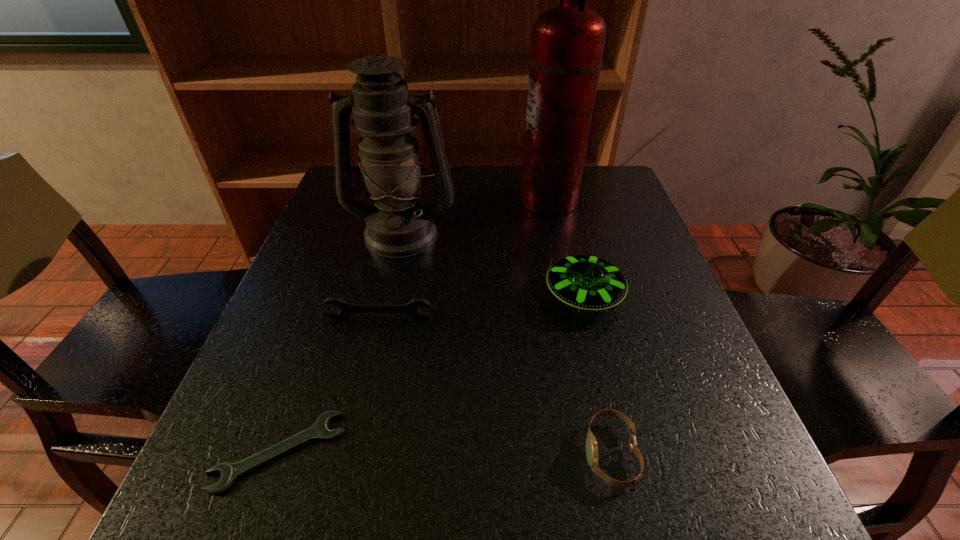
The width and height of the screenshot is (960, 540). In order to click on wrench situated at the near edge in this screenshot , I will do `click(229, 472)`.

Image resolution: width=960 pixels, height=540 pixels. I want to click on oil lamp at the left edge, so click(399, 225).

You are a GUI agent. You are given a task and a screenshot of the screen. Output one action in this format:
    pyautogui.click(x=<x>, y=<y>)
    Task: Click on the fire extinguisher that is positioned at the right edge
    The width and height of the screenshot is (960, 540).
    Given the screenshot: What is the action you would take?
    pyautogui.click(x=567, y=44)

The image size is (960, 540). In order to click on saucer that is positioned at the right edge in this screenshot , I will do coord(585,282).

At what (x,y) coordinates should I click in order to perform the action: click on object present at the far left corner. Please return your answer as a coordinate pair (x, y). This screenshot has width=960, height=540. Looking at the image, I should click on (399, 225).

Where is `object at the near left corner`? object at the near left corner is located at coordinates (229, 472).

Where is `object located in the far right corner section of the desktop`? This screenshot has width=960, height=540. object located in the far right corner section of the desktop is located at coordinates (567, 44).

The height and width of the screenshot is (540, 960). I want to click on vacant space at the far edge of the desktop, so click(x=492, y=189).

Where is `vacant area at the left edge`? This screenshot has height=540, width=960. vacant area at the left edge is located at coordinates (255, 378).

I want to click on free space at the right edge, so [631, 234].